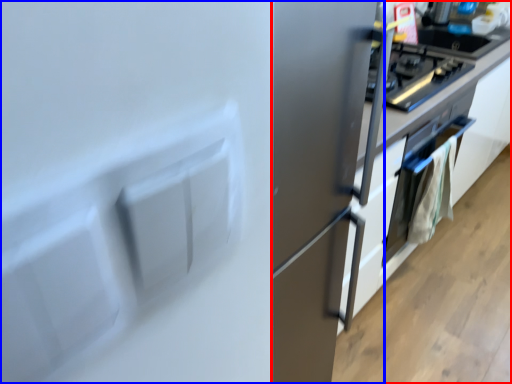
Question: Which of the following is the closest to the observer, cabinetry (highlighted by a red box) or fridge (highlighted by a blue box)?

Choices:
 (A) cabinetry
 (B) fridge

Answer: (B)